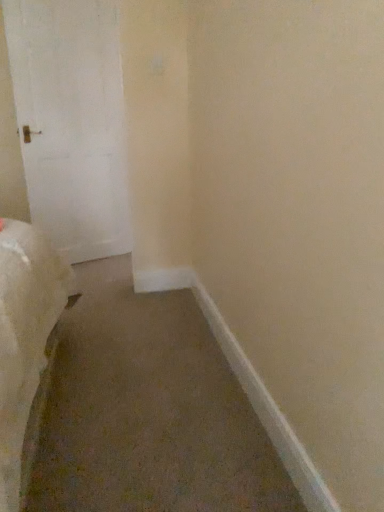
What do you see at coordinates (268, 411) in the screenshot? I see `white smooth baseboard at lower right` at bounding box center [268, 411].

Image resolution: width=384 pixels, height=512 pixels. I want to click on white smooth baseboard at lower right, so click(268, 411).

What is the approximate height of white matte door at left?

white matte door at left is 1.92 meters in height.

In order to face white matte door at left, should I rotate leftwards or rightwards?

Turn left approximately 15.091 degrees to face it.

The height and width of the screenshot is (512, 384). I want to click on white matte door at left, so click(x=71, y=121).

Describe the element at coordinates (71, 121) in the screenshot. I see `white matte door at left` at that location.

I want to click on white smooth baseboard at lower right, so click(268, 411).

Is white smooth baseboard at lower right to the right of white matte door at left from the viewer's perspective?

Correct, you'll find white smooth baseboard at lower right to the right of white matte door at left.

Considering the positions of objects white smooth baseboard at lower right and white matte door at left in the image provided, who is behind, white smooth baseboard at lower right or white matte door at left?

white matte door at left is behind.

Does point (207, 294) come farther from viewer compared to point (117, 81)?

No, it is in front of (117, 81).

From the image's perspective, is white smooth baseboard at lower right located above or below white matte door at left?

Clearly, from the image's perspective, white smooth baseboard at lower right is below white matte door at left.

From a real-world perspective, is white smooth baseboard at lower right located higher than white matte door at left?

No, from a real-world perspective, white smooth baseboard at lower right is not above white matte door at left.

Considering the sizes of objects white smooth baseboard at lower right and white matte door at left in the image provided, who is wider, white smooth baseboard at lower right or white matte door at left?

With larger width is white matte door at left.

Considering the relative sizes of white smooth baseboard at lower right and white matte door at left in the image provided, is white smooth baseboard at lower right shorter than white matte door at left?

Indeed, white smooth baseboard at lower right has a lesser height compared to white matte door at left.

Considering the sizes of objects white smooth baseboard at lower right and white matte door at left in the image provided, who is bigger, white smooth baseboard at lower right or white matte door at left?

white matte door at left is bigger.

Choose the correct answer: Is white smooth baseboard at lower right inside white matte door at left or outside it?

white smooth baseboard at lower right lies outside white matte door at left.

Are white smooth baseboard at lower right and white matte door at left making contact?

No, white smooth baseboard at lower right is not making contact with white matte door at left.

Is white smooth baseboard at lower right oriented away from white matte door at left?

That's not correct — white smooth baseboard at lower right is not looking away from white matte door at left.

How many degrees apart are the facing directions of white smooth baseboard at lower right and white matte door at left?

114 degrees separate the facing orientations of white smooth baseboard at lower right and white matte door at left.

Identify the location of molding on the right of white matte door at left. The width and height of the screenshot is (384, 512). (268, 411).

Visually, is white matte door at left positioned to the left or to the right of white smooth baseboard at lower right?

From the image, it's evident that white matte door at left is to the left of white smooth baseboard at lower right.

Based on the photo, is white matte door at left in front of or behind white smooth baseboard at lower right in the image?

white matte door at left is behind white smooth baseboard at lower right.

Does point (28, 40) come closer to viewer compared to point (311, 467)?

No.

Looking at this image, from the image's perspective, between white matte door at left and white smooth baseboard at lower right, which one is located above?

white matte door at left, from the image's perspective.

From a real-world perspective, is white matte door at left physically located above or below white smooth baseboard at lower right?

From a real-world perspective, white matte door at left is physically above white smooth baseboard at lower right.

Looking at their sizes, would you say white matte door at left is wider or thinner than white smooth baseboard at lower right?

Considering their sizes, white matte door at left looks broader than white smooth baseboard at lower right.

Who is shorter, white matte door at left or white smooth baseboard at lower right?

Standing shorter between the two is white smooth baseboard at lower right.

Considering the sizes of objects white matte door at left and white smooth baseboard at lower right in the image provided, who is bigger, white matte door at left or white smooth baseboard at lower right?

With larger size is white matte door at left.

Is white matte door at left inside the boundaries of white smooth baseboard at lower right, or outside?

white matte door at left lies outside white smooth baseboard at lower right.

Are white matte door at left and white smooth baseboard at lower right located far from each other?

Indeed, white matte door at left is not near white smooth baseboard at lower right.

Is white matte door at left positioned with its back to white smooth baseboard at lower right?

No, white matte door at left is not facing the opposite direction of white smooth baseboard at lower right.

How different are the orientations of white matte door at left and white smooth baseboard at lower right in degrees?

114 degrees separate the facing orientations of white matte door at left and white smooth baseboard at lower right.

This screenshot has width=384, height=512. In order to click on molding below the white matte door at left (from a real-world perspective) in this screenshot , I will do `click(268, 411)`.

Image resolution: width=384 pixels, height=512 pixels. Identify the location of door above the white smooth baseboard at lower right (from the image's perspective). (71, 121).

Find the location of a particular element. door lying on the left of white smooth baseboard at lower right is located at coordinates (71, 121).